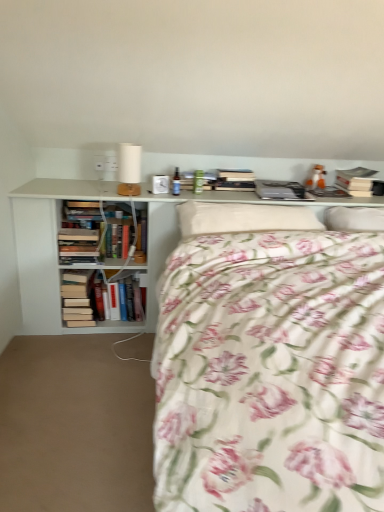
Image resolution: width=384 pixels, height=512 pixels. What do you see at coordinates (46, 248) in the screenshot?
I see `white matte bookcase at upper center` at bounding box center [46, 248].

Find the location of a particular element. The height and width of the screenshot is (512, 384). white soft pillow at upper right, which is counted as the 1th pillow, starting from the right is located at coordinates (354, 218).

Describe the element at coordinates (354, 218) in the screenshot. I see `white soft pillow at upper right, which is counted as the 1th pillow, starting from the right` at that location.

What do you see at coordinates (77, 245) in the screenshot?
I see `hardcover books at left, positioned as the 2th book in top-to-bottom order` at bounding box center [77, 245].

The image size is (384, 512). Identify the location of white matte bookcase at upper center. 46,248.

Is beige carpet at lower left spatially inside hardcover books at left, the 1th book in the bottom-to-top sequence, or outside of it?

The correct answer is: outside.

Could you tell me if beige carpet at lower left is facing hardcover books at left, which is the first book in left-to-right order?

No, beige carpet at lower left is not oriented towards hardcover books at left, which is the first book in left-to-right order.

Considering the sizes of beige carpet at lower left and hardcover books at left, the 1th book in the bottom-to-top sequence, in the image, is beige carpet at lower left bigger or smaller than hardcover books at left, the 1th book in the bottom-to-top sequence,?

In the image, beige carpet at lower left appears to be larger than hardcover books at left, the 1th book in the bottom-to-top sequence.

From the image's perspective, is beige carpet at lower left below hardcover books at left, the 1th book in the bottom-to-top sequence?

Indeed, from the image's perspective, beige carpet at lower left is shown beneath hardcover books at left, the 1th book in the bottom-to-top sequence.

From the image's perspective, is hardcover books at left, the 2th book in the left-to-right sequence, beneath white matte table lamp at upper center?

Yes, from the image's perspective, hardcover books at left, the 2th book in the left-to-right sequence, is below white matte table lamp at upper center.

In order to click on table lamp on the right of hardcover books at left, the 2th book in the left-to-right sequence in this screenshot , I will do tap(129, 169).

Is hardcover books at left, positioned as the 2th book in top-to-bottom order, smaller than white matte table lamp at upper center?

No.

From a real-world perspective, is hardcover books at left, placed as the 2th book when sorted from bottom to top, physically above white matte table lamp at upper center?

Incorrect, from a real-world perspective, hardcover books at left, placed as the 2th book when sorted from bottom to top, is lower than white matte table lamp at upper center.

From the image's perspective, is hardcover books at left, which is the second book from right to left, located beneath hardcover books at left, the 1th book in the bottom-to-top sequence?

No.

Is hardcover books at left, which is the first book in left-to-right order, surrounded by hardcover books at left, positioned as the 2th book in top-to-bottom order?

Definitely not — hardcover books at left, which is the first book in left-to-right order, is not inside hardcover books at left, positioned as the 2th book in top-to-bottom order.

Which object is closer to the camera, hardcover books at left, positioned as the 2th book in top-to-bottom order, or hardcover books at left, positioned as the 3th book in right-to-left order?

hardcover books at left, positioned as the 2th book in top-to-bottom order, is more forward.

From the image's perspective, is fluffy white pillow at center, placed as the 2th pillow when sorted from right to left, on white matte table lamp at upper center?

No, from the image's perspective, fluffy white pillow at center, placed as the 2th pillow when sorted from right to left, is not on top of white matte table lamp at upper center.

Is white matte table lamp at upper center completely or partially inside fluffy white pillow at center, which is the 1th pillow in left-to-right order?

No, white matte table lamp at upper center is not a part of fluffy white pillow at center, which is the 1th pillow in left-to-right order.

Is fluffy white pillow at center, placed as the 2th pillow when sorted from right to left, oriented away from white matte table lamp at upper center?

That's not correct — fluffy white pillow at center, placed as the 2th pillow when sorted from right to left, is not looking away from white matte table lamp at upper center.

Between point (230, 218) and point (123, 189), which one is positioned behind?

Positioned behind is point (123, 189).

From the image's perspective, who appears lower, hardcover books at left, which is the first book in left-to-right order, or white matte table lamp at upper center?

hardcover books at left, which is the first book in left-to-right order, is shown below in the image.

Consider the image. Considering their positions, is hardcover books at left, positioned as the 3th book in right-to-left order, located in front of or behind white matte table lamp at upper center?

Clearly, hardcover books at left, positioned as the 3th book in right-to-left order, is behind white matte table lamp at upper center.

The width and height of the screenshot is (384, 512). I want to click on table lamp above the hardcover books at left, the 1th book in the bottom-to-top sequence (from the image's perspective), so click(x=129, y=169).

Does hardcover books at left, the 1th book in the bottom-to-top sequence, turn towards white matte table lamp at upper center?

No, hardcover books at left, the 1th book in the bottom-to-top sequence, is not turned towards white matte table lamp at upper center.

Is white soft pillow at upper right, the second pillow positioned from the left, smaller than hardcover books at left, positioned as the 2th book in top-to-bottom order?

No.

Considering the sizes of objects white soft pillow at upper right, the second pillow positioned from the left, and hardcover books at left, the 2th book in the left-to-right sequence, in the image provided, who is thinner, white soft pillow at upper right, the second pillow positioned from the left, or hardcover books at left, the 2th book in the left-to-right sequence,?

hardcover books at left, the 2th book in the left-to-right sequence, is thinner.

Are white matte table lamp at upper center and floral cotton bed at center making contact?

No.

Between white matte table lamp at upper center and floral cotton bed at center, which one appears on the left side from the viewer's perspective?

white matte table lamp at upper center.

From the image's perspective, which object appears higher, white matte table lamp at upper center or floral cotton bed at center?

white matte table lamp at upper center appears higher in the image.

Is white matte table lamp at upper center smaller than floral cotton bed at center?

Yes.

I want to click on the 1st book positioned above the beige carpet at lower left (from a real-world perspective), so click(77, 298).

Locate an element on the screen. This screenshot has width=384, height=512. the 1st book behind the white matte table lamp at upper center is located at coordinates (77, 245).

In the scene shown: Based on their spatial positions, is hardcover books at left, placed as the 2th book when sorted from bottom to top, or beige carpet at lower left further from hardcover book at upper right, the third book when ordered from bottom to top?

The object further to hardcover book at upper right, the third book when ordered from bottom to top, is beige carpet at lower left.

Which object lies further to the anchor point fluffy white pillow at center, placed as the 2th pillow when sorted from right to left, white matte table lamp at upper center or hardcover books at left, which is the first book in left-to-right order?

Among the two, hardcover books at left, which is the first book in left-to-right order, is located further to fluffy white pillow at center, placed as the 2th pillow when sorted from right to left.

When comparing their distances from hardcover books at left, placed as the 2th book when sorted from bottom to top, does floral cotton bed at center or hardcover books at left, placed as the third book when sorted from top to bottom, seem closer?

hardcover books at left, placed as the third book when sorted from top to bottom, lies closer to hardcover books at left, placed as the 2th book when sorted from bottom to top, than the other object.

Looking at the image, which one is located closer to white matte bookcase at upper center, fluffy white pillow at center, placed as the 2th pillow when sorted from right to left, or hardcover book at upper right, the first book in the top-to-bottom sequence?

fluffy white pillow at center, placed as the 2th pillow when sorted from right to left, is positioned closer to the anchor white matte bookcase at upper center.

Estimate the real-world distances between objects in this image. Which object is further from beige carpet at lower left, hardcover books at left, positioned as the 3th book in right-to-left order, or fluffy white pillow at center, which is the 1th pillow in left-to-right order?

fluffy white pillow at center, which is the 1th pillow in left-to-right order, is further to beige carpet at lower left.

From the image, which object appears to be nearer to white soft pillow at upper right, the second pillow positioned from the left, hardcover books at left, placed as the 2th book when sorted from bottom to top, or white matte table lamp at upper center?

white matte table lamp at upper center.

When comparing their distances from fluffy white pillow at center, placed as the 2th pillow when sorted from right to left, does white matte table lamp at upper center or floral cotton bed at center seem closer?

floral cotton bed at center is closer to fluffy white pillow at center, placed as the 2th pillow when sorted from right to left.

From the image, which object appears to be farther from fluffy white pillow at center, placed as the 2th pillow when sorted from right to left, hardcover book at upper right, the third book when ordered from bottom to top, or white matte bookcase at upper center?

Based on the image, hardcover book at upper right, the third book when ordered from bottom to top, appears to be further to fluffy white pillow at center, placed as the 2th pillow when sorted from right to left.

This screenshot has height=512, width=384. Find the location of `bookcase between white matte table lamp at upper center and white soft pillow at upper right, which is counted as the 1th pillow, starting from the right, in the horizontal direction`. bookcase between white matte table lamp at upper center and white soft pillow at upper right, which is counted as the 1th pillow, starting from the right, in the horizontal direction is located at coordinates (46, 248).

Find the location of `bookcase between beige carpet at lower left and hardcover books at left, positioned as the 3th book in right-to-left order, along the z-axis`. bookcase between beige carpet at lower left and hardcover books at left, positioned as the 3th book in right-to-left order, along the z-axis is located at coordinates (46, 248).

Locate an element on the screen. pillow situated between white matte bookcase at upper center and white soft pillow at upper right, the second pillow positioned from the left, from left to right is located at coordinates (243, 218).

Locate an element on the screen. The image size is (384, 512). table lamp situated between hardcover books at left, which is the first book in left-to-right order, and white matte bookcase at upper center from left to right is located at coordinates (129, 169).